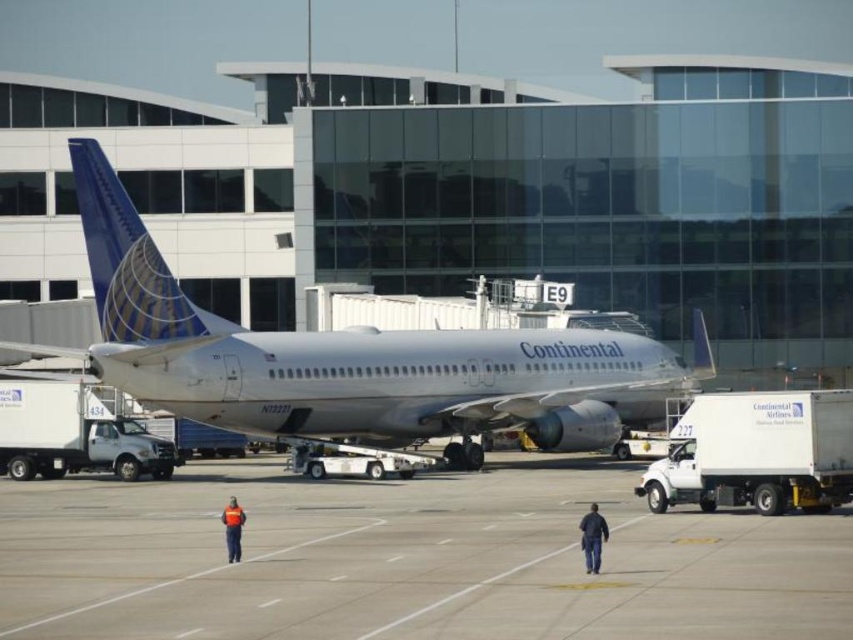
Question: Which of these objects is positioned farthest from the orange reflective vest at center?

Choices:
 (A) white metallic airplane at center
 (B) dark blue jeans at lower center
 (C) gray concrete tarmac at center

Answer: (A)

Question: Can you confirm if white metallic airplane at center is positioned to the left of orange reflective vest at center?

Choices:
 (A) no
 (B) yes

Answer: (A)

Question: Estimate the real-world distances between objects in this image. Which object is farther from the dark blue jeans at lower center?

Choices:
 (A) gray concrete tarmac at center
 (B) white metallic airplane at center

Answer: (B)

Question: Does gray concrete tarmac at center have a greater width compared to dark blue jeans at lower center?

Choices:
 (A) yes
 (B) no

Answer: (A)

Question: Is white metallic airplane at center positioned at the back of orange reflective vest at center?

Choices:
 (A) no
 (B) yes

Answer: (B)

Question: Which point is closer to the camera?

Choices:
 (A) white metallic airplane at center
 (B) orange reflective vest at center
 (C) dark blue jeans at lower center
 (D) gray concrete tarmac at center

Answer: (D)